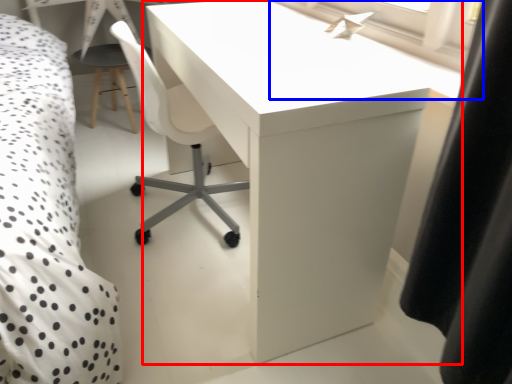
Question: Which object is further to the camera taking this photo, table (highlighted by a red box) or window screen (highlighted by a blue box)?

Choices:
 (A) table
 (B) window screen

Answer: (B)